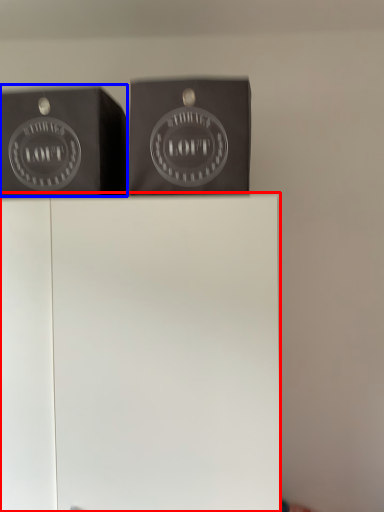
Question: Which point is further to the camera, furniture (highlighted by a red box) or writing (highlighted by a blue box)?

Choices:
 (A) furniture
 (B) writing

Answer: (B)